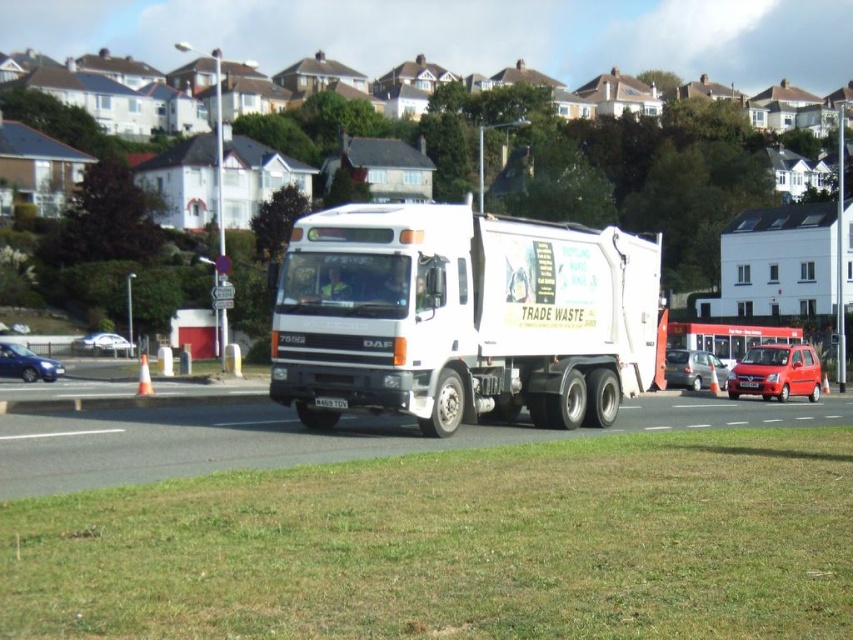
Question: Which point is farther to the camera?

Choices:
 (A) [323, 401]
 (B) [21, 356]

Answer: (B)

Question: Which object is the farthest from the silver metallic van at center?

Choices:
 (A) shiny red van at center
 (B) black plastic license plate at center

Answer: (B)

Question: Is silver metallic van at center thinner than matte blue car at lower left?

Choices:
 (A) no
 (B) yes

Answer: (B)

Question: Considering the real-world distances, which object is closest to the white matte truck at center?

Choices:
 (A) shiny silver sedan at left
 (B) white plastic license plate at center
 (C) shiny red van at center
 (D) matte blue car at lower left

Answer: (B)

Question: Can you confirm if shiny red van at center is smaller than black plastic license plate at center?

Choices:
 (A) no
 (B) yes

Answer: (A)

Question: Can you confirm if white matte truck at center is positioned below silver metallic van at center?

Choices:
 (A) yes
 (B) no

Answer: (B)